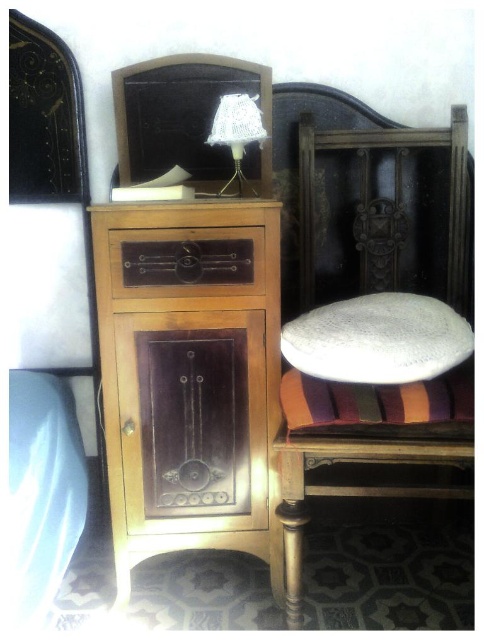
Consider the image. Where is the black leather headboard at upper center located in the image?

The black leather headboard at upper center is located at point coordinates of 0.180 on the x axis and 0.372 on the y axis.

Based on the photo, you are trying to hang a picture frame that requires 1.5 meters of height clearance. You have two options in the room where the black leather headboard at upper center and wooden drawer at center are located. Which object should you choose to ensure the frame can be hung without hitting the ceiling?

The black leather headboard at upper center is much taller than the wooden drawer at center, so it provides sufficient height clearance for the picture frame requiring 1.5 meters.